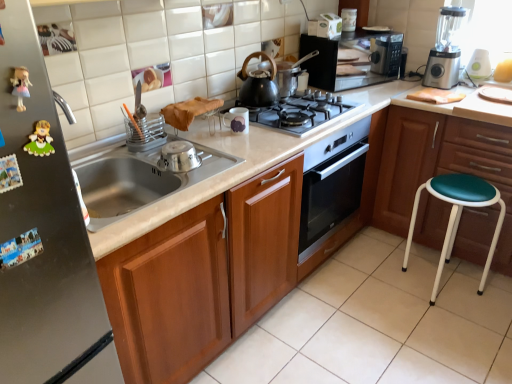
You are a GUI agent. You are given a task and a screenshot of the screen. Output one action in this format:
    pyautogui.click(x=<x>, y=<y>)
    Task: Click on the free location to the left of white glossy mug at upper center, which is the second appliance from top to bottom
    Image resolution: width=512 pixels, height=384 pixels.
    Given the screenshot: What is the action you would take?
    (207, 130)